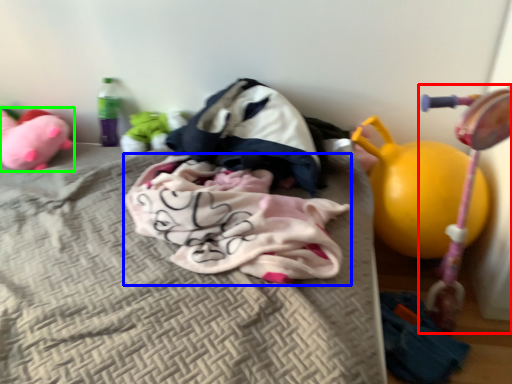
Question: Considering the real-world distances, which object is closest to baby carriage (highlighted by a red box)? baby clothe (highlighted by a blue box) or toy (highlighted by a green box).

Choices:
 (A) baby clothe
 (B) toy

Answer: (A)